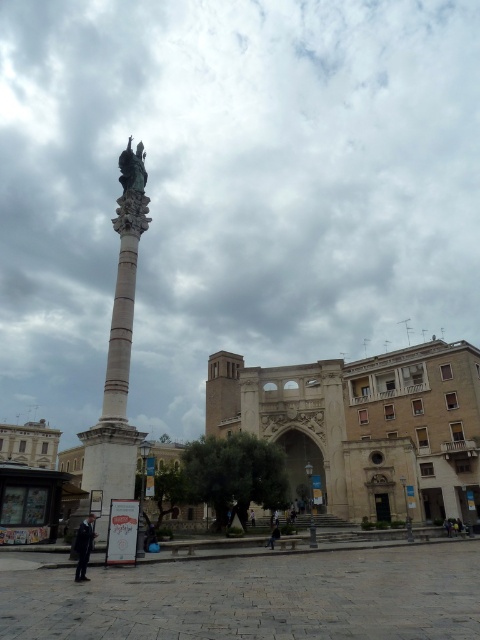
Question: Is the position of white marble column at center less distant than that of bronze statue at upper center?

Choices:
 (A) yes
 (B) no

Answer: (A)

Question: Is white marble column at center to the left of bronze statue at upper center from the viewer's perspective?

Choices:
 (A) yes
 (B) no

Answer: (B)

Question: Which point is farther to the camera?

Choices:
 (A) white cotton shirt at center
 (B) dark suit at lower left

Answer: (A)

Question: Where is bronze statue at upper center located in relation to dark blue jeans at lower center in the image?

Choices:
 (A) right
 (B) left

Answer: (B)

Question: Which of these objects is positioned farthest from the white cotton shirt at center?

Choices:
 (A) dark blue jeans at lower center
 (B) white marble column at center

Answer: (B)

Question: Among these objects, which one is nearest to the camera?

Choices:
 (A) white cotton shirt at center
 (B) dark suit at lower left
 (C) bronze statue at upper center

Answer: (B)